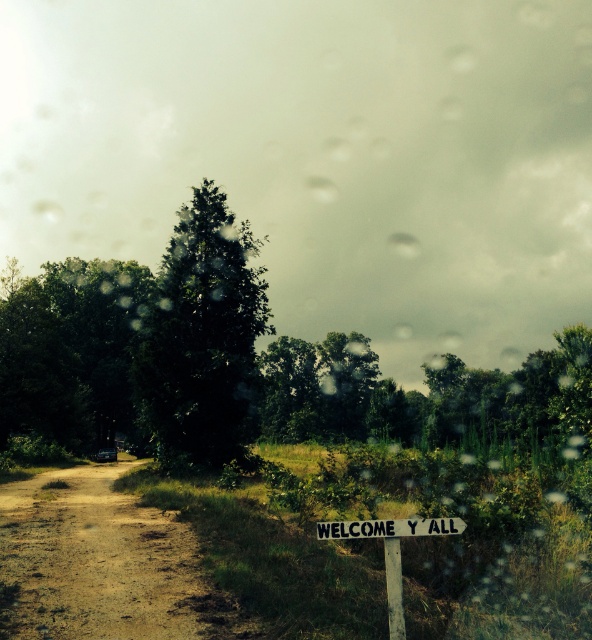
The height and width of the screenshot is (640, 592). Describe the element at coordinates (101, 563) in the screenshot. I see `brown dirt track at lower left` at that location.

Between brown dirt track at lower left and green leafy tree at center, which one is positioned higher?

Positioned higher is green leafy tree at center.

Between point (188, 621) and point (200, 387), which one is positioned behind?

The point (200, 387) is behind.

I want to click on brown dirt track at lower left, so click(101, 563).

Is green leafy tree at center to the left of transparent glass car window at center from the viewer's perspective?

Incorrect, green leafy tree at center is not on the left side of transparent glass car window at center.

Which is above, green leafy tree at center or transparent glass car window at center?

green leafy tree at center

Is point (239, 349) positioned behind point (108, 458)?

No, it is not.

Identify the location of green leafy tree at center. (201, 337).

Does green leafy tree at center have a lesser width compared to white wooden sign at lower center?

In fact, green leafy tree at center might be wider than white wooden sign at lower center.

What do you see at coordinates (201, 337) in the screenshot? Image resolution: width=592 pixels, height=640 pixels. I see `green leafy tree at center` at bounding box center [201, 337].

Identify the location of green leafy tree at center. (201, 337).